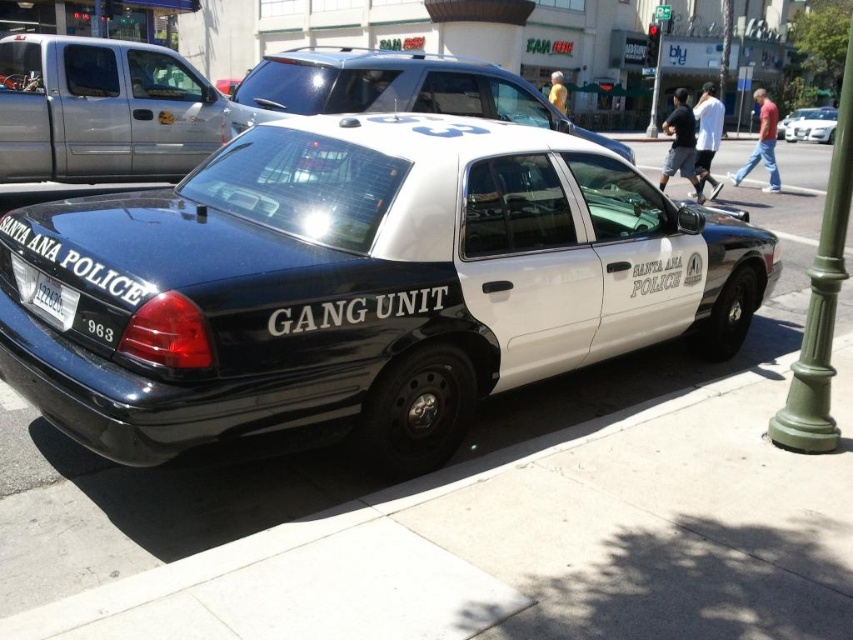
Question: Which point is farther from the camera taking this photo?

Choices:
 (A) (831, 173)
 (B) (799, 116)
 (C) (265, 77)
 (D) (357, 118)

Answer: (B)

Question: Is white glossy sedan at center smaller than metallic silver sedan at center?

Choices:
 (A) yes
 (B) no

Answer: (A)

Question: Is matte black police car at center to the right of metallic silver sedan at center from the viewer's perspective?

Choices:
 (A) no
 (B) yes

Answer: (A)

Question: Which of the following is the closest to the observer?

Choices:
 (A) green metal pole at right
 (B) white plastic license plate at lower left
 (C) white glossy sedan at center
 (D) matte black police car at center

Answer: (D)

Question: Which object is positioned closest to the white plastic license plate at lower left?

Choices:
 (A) matte black police car at center
 (B) white glossy sedan at center

Answer: (A)

Question: Can you confirm if white plastic license plate at lower left is positioned above white glossy sedan at center?

Choices:
 (A) no
 (B) yes

Answer: (A)